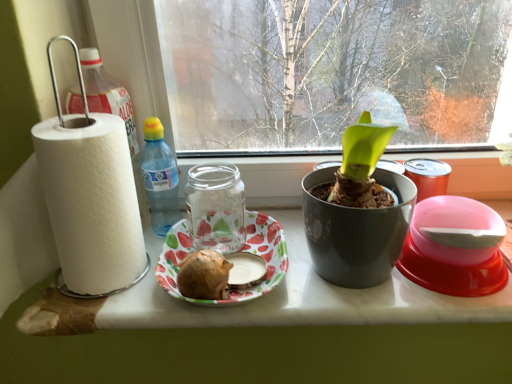
The image size is (512, 384). What are the coordinates of `unoccupied region to the right of strawberry-patterned paper plate at center` in the screenshot? It's located at (331, 281).